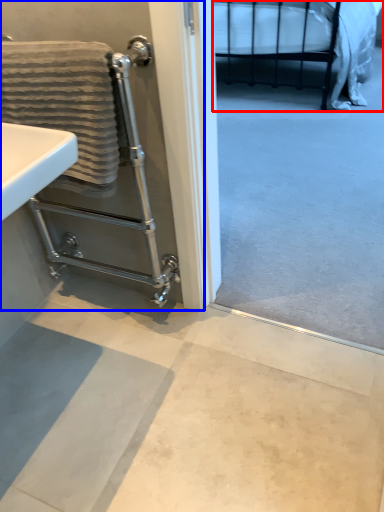
Question: Which object is further to the camera taking this photo, bed (highlighted by a red box) or screen door (highlighted by a blue box)?

Choices:
 (A) bed
 (B) screen door

Answer: (A)